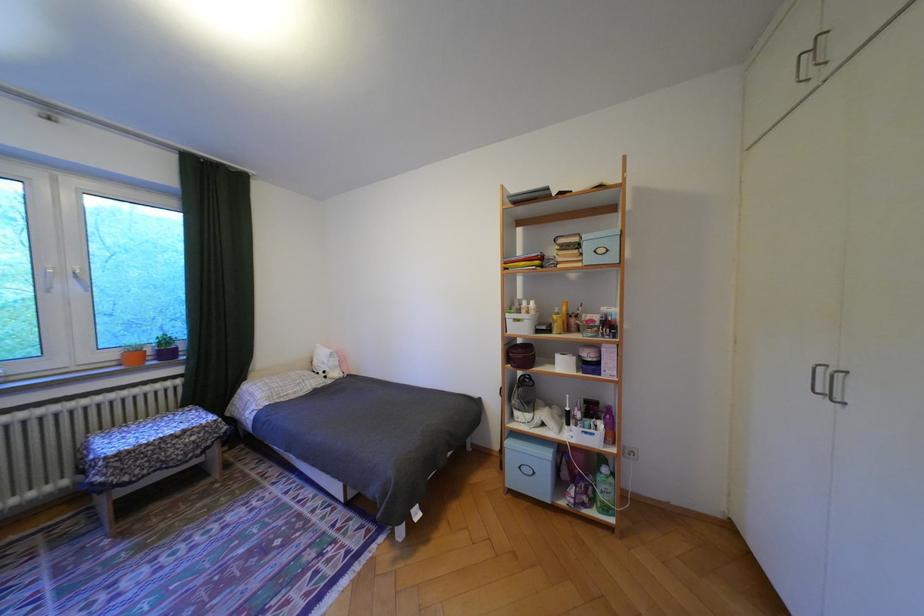
Identify the location of light blue box. The width and height of the screenshot is (924, 616). (529, 475).